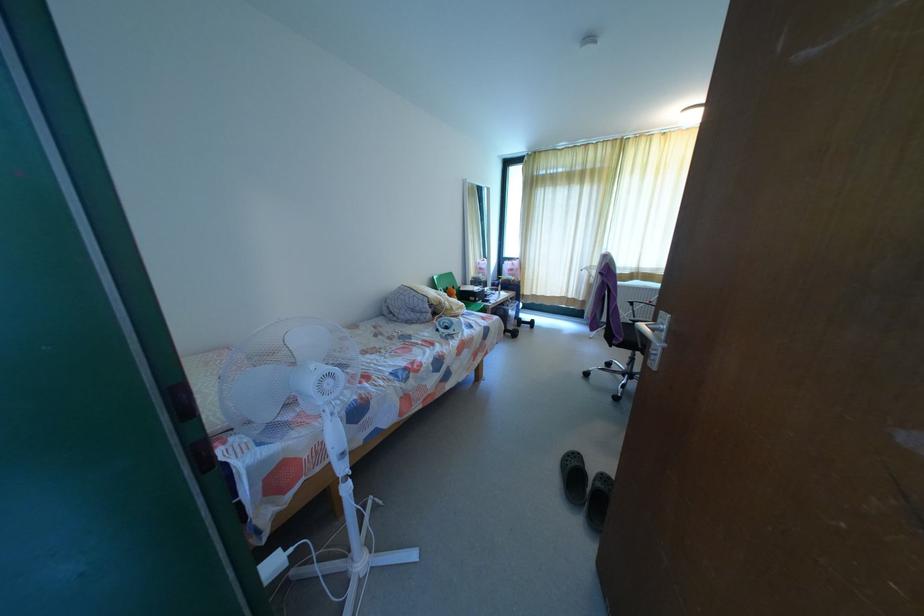
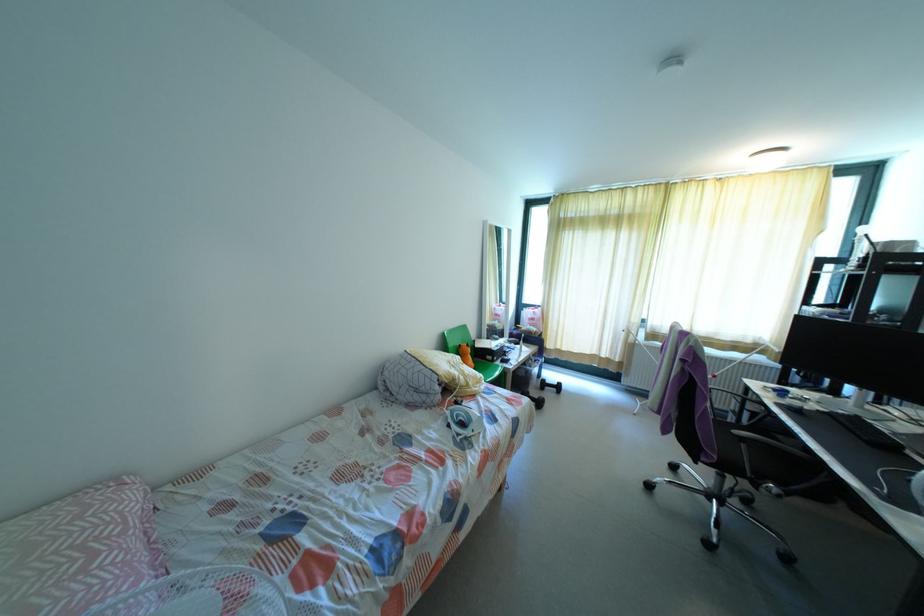
Find the pixel in the second image that matches (511,270) in the first image.

(531, 318)